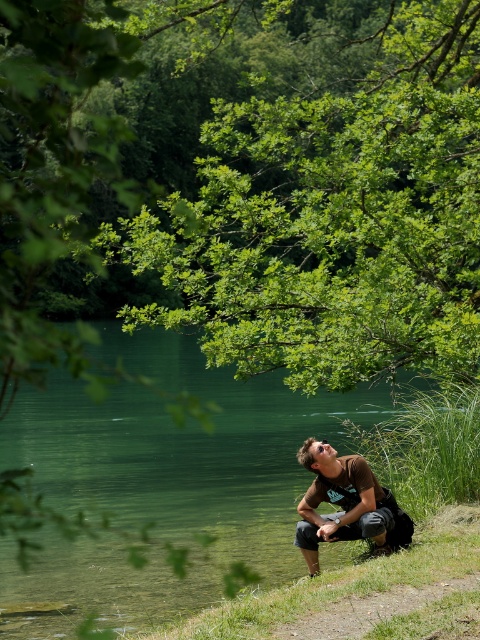
I want to click on green translucent water at lower left, so click(182, 449).

Is green translucent water at lower left in front of brown cotton shirt at center?

That is True.

Is point (254, 401) farther from viewer compared to point (312, 436)?

Yes, it is.

At what (x,y) coordinates should I click in order to perform the action: click on green translucent water at lower left. Please return your answer as a coordinate pair (x, y). The height and width of the screenshot is (640, 480). Looking at the image, I should click on (182, 449).